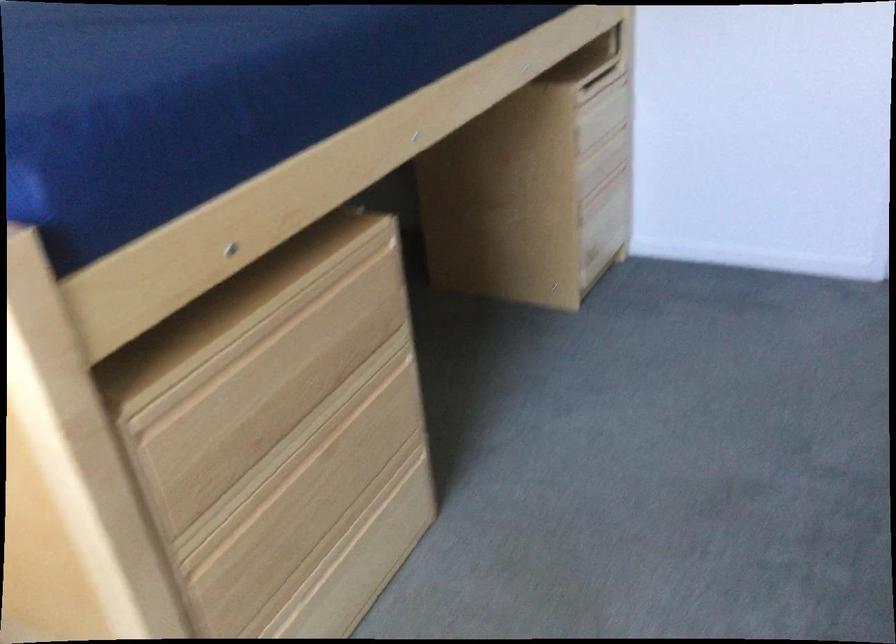
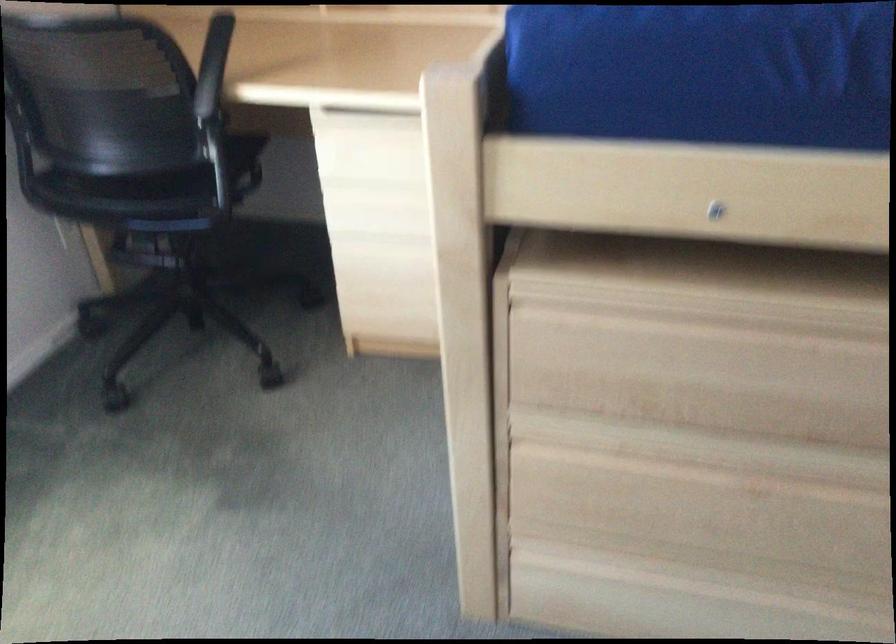
The first image is from the beginning of the video and the second image is from the end. How did the camera likely rotate when shooting the video?

The rotation direction of the camera is left-down.